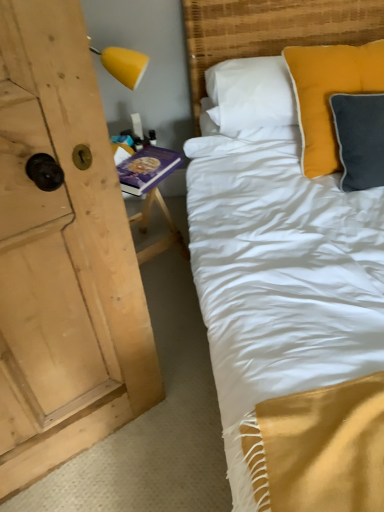
Question: From a real-world perspective, does purple hardcover book at left stand above matte yellow pillow at upper right?

Choices:
 (A) yes
 (B) no

Answer: (B)

Question: Are purple hardcover book at left and matte yellow pillow at upper right making contact?

Choices:
 (A) no
 (B) yes

Answer: (A)

Question: Does purple hardcover book at left have a lesser height compared to matte yellow pillow at upper right?

Choices:
 (A) no
 (B) yes

Answer: (B)

Question: Does purple hardcover book at left turn towards matte yellow pillow at upper right?

Choices:
 (A) no
 (B) yes

Answer: (A)

Question: From the image's perspective, is purple hardcover book at left located beneath matte yellow pillow at upper right?

Choices:
 (A) no
 (B) yes

Answer: (B)

Question: From a real-world perspective, is matte yellow pillow at upper right above or below purple hardcover book at left?

Choices:
 (A) below
 (B) above

Answer: (B)

Question: From the image's perspective, is matte yellow pillow at upper right located above or below purple hardcover book at left?

Choices:
 (A) above
 (B) below

Answer: (A)

Question: Is matte yellow pillow at upper right to the left or to the right of purple hardcover book at left in the image?

Choices:
 (A) right
 (B) left

Answer: (A)

Question: In the image, is matte yellow pillow at upper right positioned in front of or behind purple hardcover book at left?

Choices:
 (A) front
 (B) behind

Answer: (A)

Question: Based on their positions, is woven bamboo headboard at upper right located to the left or right of matte yellow pillow at upper right?

Choices:
 (A) left
 (B) right

Answer: (A)

Question: Is woven bamboo headboard at upper right in front of or behind matte yellow pillow at upper right in the image?

Choices:
 (A) front
 (B) behind

Answer: (B)

Question: From the image's perspective, is woven bamboo headboard at upper right positioned above or below matte yellow pillow at upper right?

Choices:
 (A) below
 (B) above

Answer: (B)

Question: Considering the positions of woven bamboo headboard at upper right and matte yellow pillow at upper right in the image, is woven bamboo headboard at upper right bigger or smaller than matte yellow pillow at upper right?

Choices:
 (A) big
 (B) small

Answer: (A)

Question: Looking at their shapes, would you say matte yellow pillow at upper right is wider or thinner than woven bamboo headboard at upper right?

Choices:
 (A) thin
 (B) wide

Answer: (A)

Question: Is point (309, 141) closer or farther from the camera than point (306, 10)?

Choices:
 (A) closer
 (B) farther

Answer: (A)